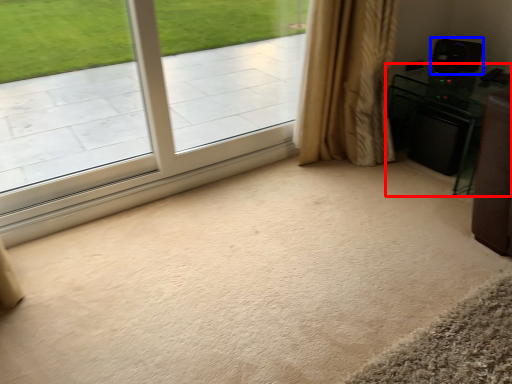
Question: Which point is further to the camera, furniture (highlighted by a red box) or speaker (highlighted by a blue box)?

Choices:
 (A) furniture
 (B) speaker

Answer: (B)